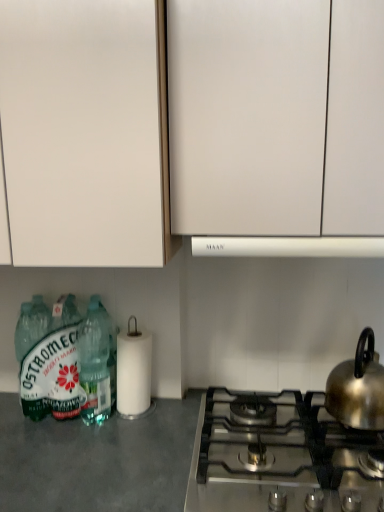
Question: Is green matte bottle at lower left, which is the 2th bottle from right to left, not inside translucent plastic bottles at lower left, placed as the second bottle when sorted from left to right?

Choices:
 (A) no
 (B) yes

Answer: (B)

Question: Is green matte bottle at lower left, which is the 2th bottle from right to left, bigger than translucent plastic bottles at lower left, placed as the second bottle when sorted from left to right?

Choices:
 (A) yes
 (B) no

Answer: (A)

Question: Is green matte bottle at lower left, which is the 2th bottle from right to left, next to translucent plastic bottles at lower left, arranged as the 1th bottle when viewed from the right, and touching it?

Choices:
 (A) no
 (B) yes

Answer: (B)

Question: Is green matte bottle at lower left, which is the 2th bottle from right to left, far away from translucent plastic bottles at lower left, placed as the second bottle when sorted from left to right?

Choices:
 (A) yes
 (B) no

Answer: (B)

Question: Does green matte bottle at lower left, the first bottle viewed from the left, turn towards translucent plastic bottles at lower left, placed as the second bottle when sorted from left to right?

Choices:
 (A) yes
 (B) no

Answer: (B)

Question: Considering the relative sizes of green matte bottle at lower left, the first bottle viewed from the left, and translucent plastic bottles at lower left, placed as the second bottle when sorted from left to right, in the image provided, is green matte bottle at lower left, the first bottle viewed from the left, taller than translucent plastic bottles at lower left, placed as the second bottle when sorted from left to right,?

Choices:
 (A) no
 (B) yes

Answer: (A)

Question: Is green matte bottle at lower left, the first bottle viewed from the left, oriented away from gray matte countertop at lower left?

Choices:
 (A) yes
 (B) no

Answer: (B)

Question: From the image's perspective, is green matte bottle at lower left, the first bottle viewed from the left, located beneath gray matte countertop at lower left?

Choices:
 (A) no
 (B) yes

Answer: (A)

Question: Is green matte bottle at lower left, the first bottle viewed from the left, at the left side of gray matte countertop at lower left?

Choices:
 (A) no
 (B) yes

Answer: (B)

Question: Considering the relative sizes of green matte bottle at lower left, which is the 2th bottle from right to left, and gray matte countertop at lower left in the image provided, is green matte bottle at lower left, which is the 2th bottle from right to left, wider than gray matte countertop at lower left?

Choices:
 (A) no
 (B) yes

Answer: (A)

Question: Is green matte bottle at lower left, which is the 2th bottle from right to left, shorter than gray matte countertop at lower left?

Choices:
 (A) no
 (B) yes

Answer: (B)

Question: Is green matte bottle at lower left, the first bottle viewed from the left, smaller than gray matte countertop at lower left?

Choices:
 (A) no
 (B) yes

Answer: (B)

Question: Is white matte cabinet at upper left, placed as the 1th cabinetry when sorted from left to right, oriented away from satin silver gas stove at lower right?

Choices:
 (A) yes
 (B) no

Answer: (B)